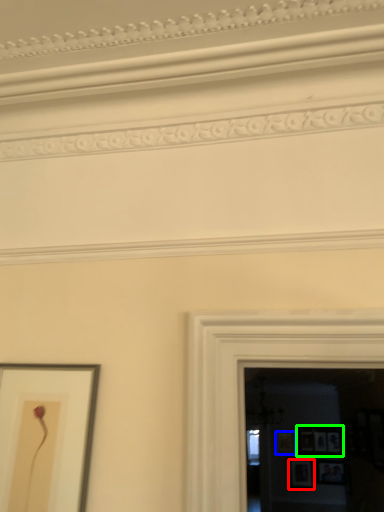
Question: Estimate the real-world distances between objects in this image. Which object is farther from picture frame (highlighted by a red box), picture frame (highlighted by a blue box) or picture frame (highlighted by a green box)?

Choices:
 (A) picture frame
 (B) picture frame

Answer: (B)